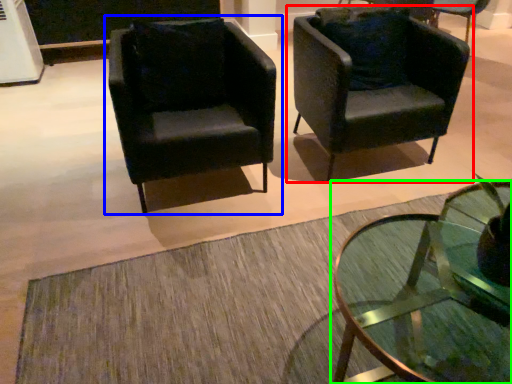
Question: Which object is positioned farthest from chair (highlighted by a red box)? Select from chair (highlighted by a blue box) and coffee table (highlighted by a green box).

Choices:
 (A) chair
 (B) coffee table

Answer: (B)